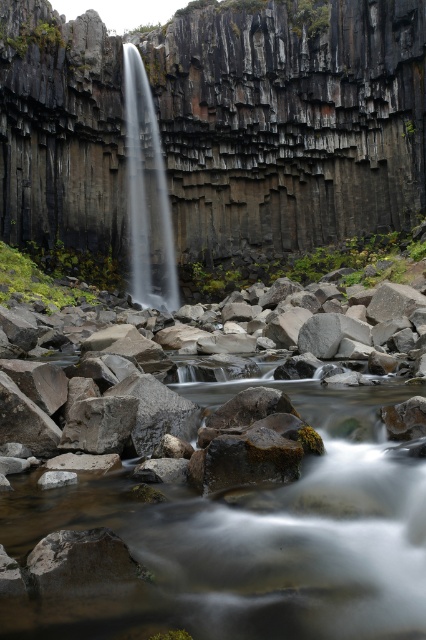
You are standing at the edge of the dark gray basalt cliff at center. If you look down, where would you see the coordinates of your current position?

The coordinates of your current position at the edge of the dark gray basalt cliff at center would be approximately at point 0.192 on the x axis and 0.681 on the y axis.

You are a hiker who wants to cross from the dark gray basalt cliff at center to the clear water at center. The path between them is 6.10 meters wide. If your hiking backpack is 1.8 meters wide, can you safely cross the path?

The path between the dark gray basalt cliff at center and the clear water at center is 6.10 meters wide. Since your backpack is only 1.8 meters wide, you can safely cross the path as the width is more than sufficient.

You are standing at the edge of the cliff and want to take a photo of the dark gray basalt cliff at center and the clear water at center. Which object should you focus on first to ensure it appears sharp in your photo?

You should focus on the dark gray basalt cliff at center first because it is closer to the viewer than the clear water at center, so focusing on the closer object ensures it will be sharp.